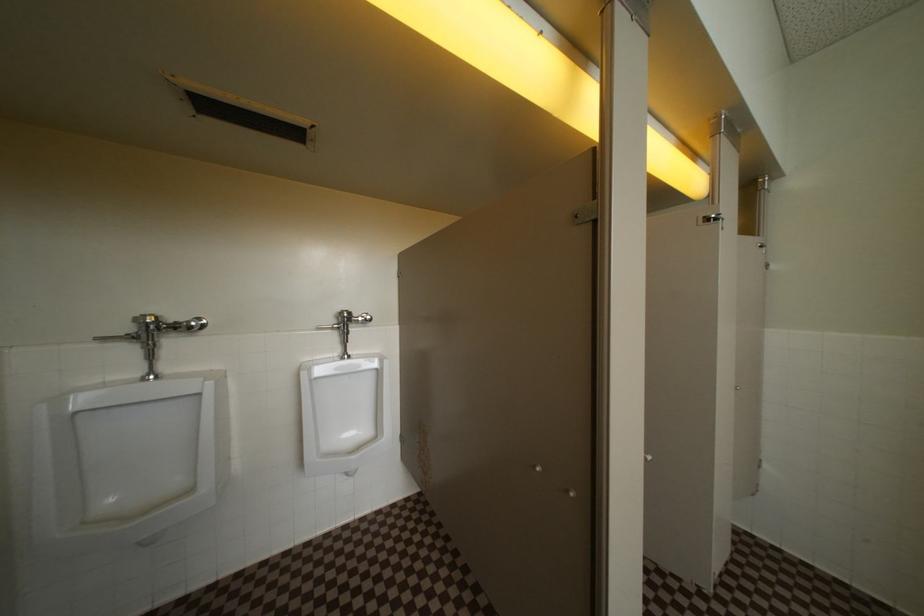
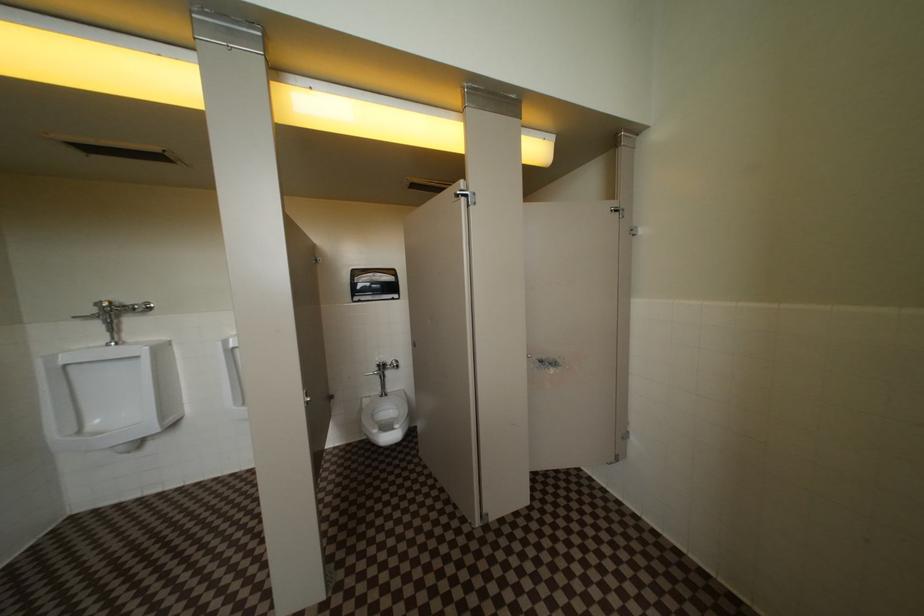
Question: The images are taken continuously from a first-person perspective. In which direction are you moving?

Choices:
 (A) Left
 (B) Right
 (C) Forward
 (D) Backward

Answer: (B)